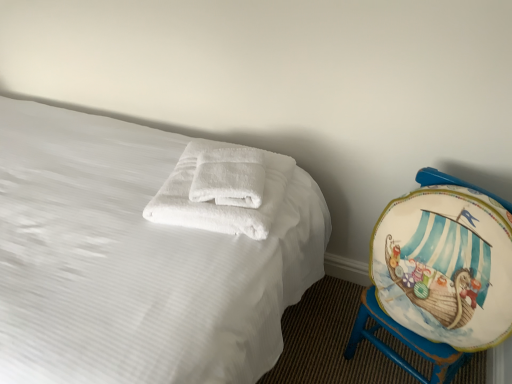
Question: Considering their positions, is white soft towel at center located in front of or behind white fluffy towels at center?

Choices:
 (A) behind
 (B) front

Answer: (A)

Question: From a real-world perspective, is white soft towel at center positioned above or below white fluffy towels at center?

Choices:
 (A) above
 (B) below

Answer: (A)

Question: Which of these objects is positioned closest to the painted wood globe at right?

Choices:
 (A) white soft towel at center
 (B) white soft towel at center
 (C) white fluffy towels at center

Answer: (C)

Question: Considering the real-world distances, which object is farthest from the white soft towel at center?

Choices:
 (A) white fluffy towels at center
 (B) painted wood globe at right
 (C) white soft towel at center

Answer: (B)